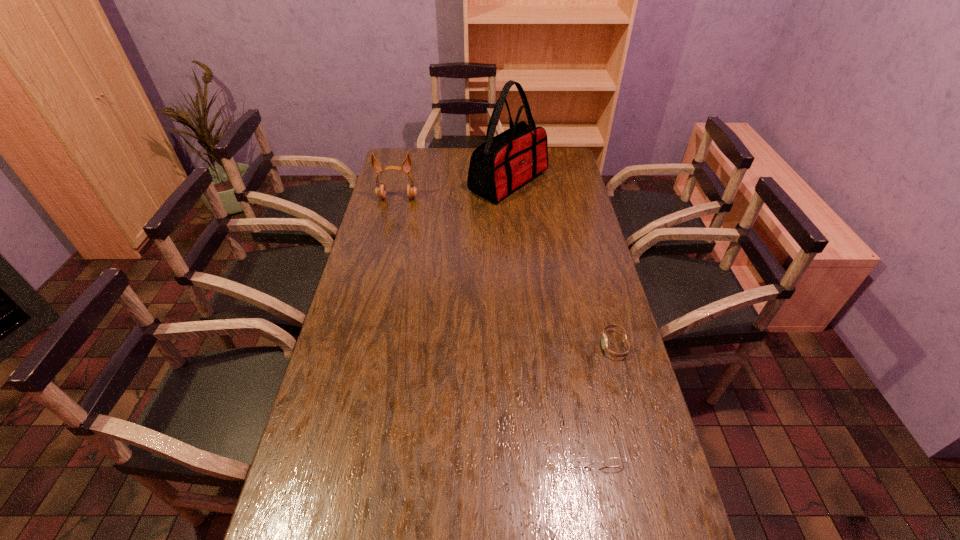
At what (x,y) coordinates should I click in order to perform the action: click on free space at the far left corner. Please return your answer as a coordinate pair (x, y). The width and height of the screenshot is (960, 540). Looking at the image, I should click on (420, 163).

Where is `free area in between the rightmost object and the duffel bag`? The image size is (960, 540). free area in between the rightmost object and the duffel bag is located at coordinates (561, 264).

Identify the location of free area in between the nearest object and the third shortest object. The width and height of the screenshot is (960, 540). (494, 320).

Where is `free space that is in between the tallest object and the second nearest object`? free space that is in between the tallest object and the second nearest object is located at coordinates (561, 264).

Identify the location of free area in between the earphone and the watch. (506, 272).

Locate an element on the screen. vacant space that's between the spectacles and the watch is located at coordinates (603, 393).

This screenshot has width=960, height=540. I want to click on free space between the third shortest object and the watch, so click(506, 272).

This screenshot has height=540, width=960. I want to click on free spot between the watch and the leftmost object, so click(x=506, y=272).

This screenshot has height=540, width=960. Find the location of `empty location between the leftmost object and the nearest object`. empty location between the leftmost object and the nearest object is located at coordinates (494, 320).

Locate an element on the screen. empty space between the nearest object and the duffel bag is located at coordinates (550, 312).